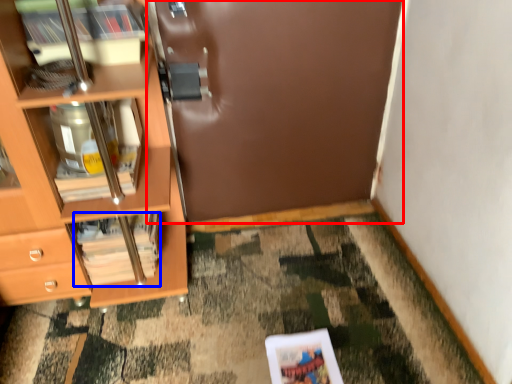
Question: Which object is closer to the camera taking this photo, door (highlighted by a red box) or magazine (highlighted by a blue box)?

Choices:
 (A) door
 (B) magazine

Answer: (A)